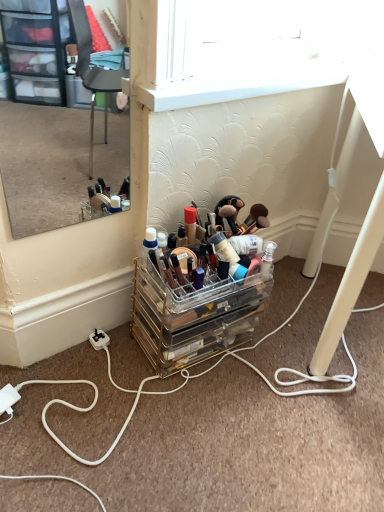
Question: Can you confirm if clear acrylic makeup organizer at center is taller than clear acrylic makeup organizer at lower center?

Choices:
 (A) yes
 (B) no

Answer: (A)

Question: Does clear acrylic makeup organizer at center contain clear acrylic makeup organizer at lower center?

Choices:
 (A) yes
 (B) no

Answer: (B)

Question: From the image's perspective, is clear acrylic makeup organizer at center on top of clear acrylic makeup organizer at lower center?

Choices:
 (A) yes
 (B) no

Answer: (B)

Question: Considering the relative sizes of clear acrylic makeup organizer at center and clear acrylic makeup organizer at lower center in the image provided, is clear acrylic makeup organizer at center bigger than clear acrylic makeup organizer at lower center?

Choices:
 (A) no
 (B) yes

Answer: (B)

Question: Is clear acrylic makeup organizer at center beside clear acrylic makeup organizer at lower center?

Choices:
 (A) yes
 (B) no

Answer: (B)

Question: Is point (208, 348) positioned closer to the camera than point (198, 496)?

Choices:
 (A) closer
 (B) farther

Answer: (B)

Question: Looking at their shapes, would you say clear acrylic makeup organizer at center is wider or thinner than white cord at lower left?

Choices:
 (A) wide
 (B) thin

Answer: (B)

Question: Considering the positions of clear acrylic makeup organizer at center and white cord at lower left in the image, is clear acrylic makeup organizer at center bigger or smaller than white cord at lower left?

Choices:
 (A) small
 (B) big

Answer: (A)

Question: From the image's perspective, is clear acrylic makeup organizer at center positioned above or below white cord at lower left?

Choices:
 (A) above
 (B) below

Answer: (A)

Question: Is point (271, 259) closer or farther from the camera than point (56, 82)?

Choices:
 (A) farther
 (B) closer

Answer: (B)

Question: From the image's perspective, relative to clear glass mirror at upper left, is clear acrylic makeup organizer at lower center above or below?

Choices:
 (A) above
 (B) below

Answer: (B)

Question: From their relative heights in the image, would you say clear acrylic makeup organizer at lower center is taller or shorter than clear glass mirror at upper left?

Choices:
 (A) short
 (B) tall

Answer: (A)

Question: Which is correct: clear acrylic makeup organizer at lower center is inside clear glass mirror at upper left, or outside of it?

Choices:
 (A) inside
 (B) outside

Answer: (B)

Question: Is white cord at lower left inside the boundaries of clear acrylic makeup organizer at center, or outside?

Choices:
 (A) outside
 (B) inside

Answer: (A)

Question: Considering the relative positions of white cord at lower left and clear acrylic makeup organizer at center in the image provided, is white cord at lower left to the left or to the right of clear acrylic makeup organizer at center?

Choices:
 (A) left
 (B) right

Answer: (B)